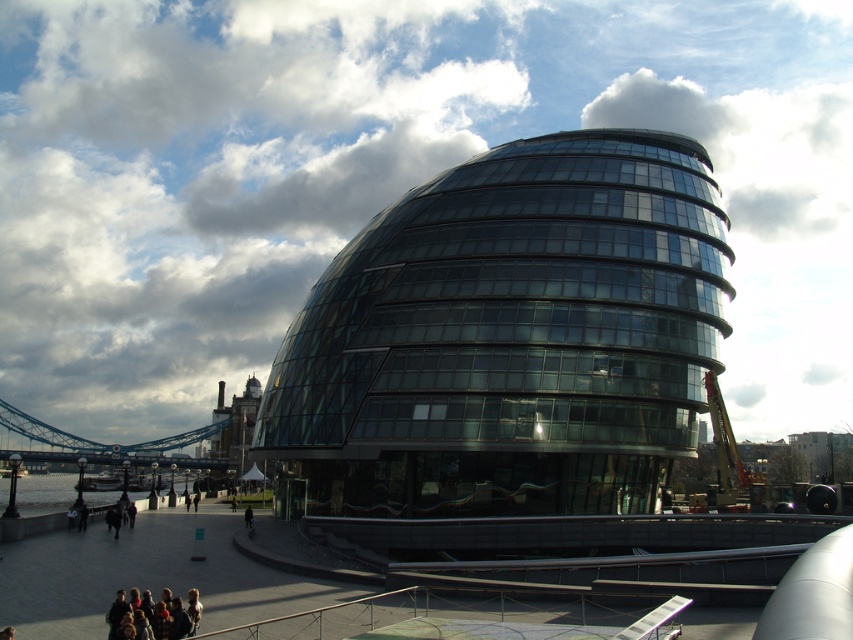
Which is above, transparent glass dome at center or metallic gray suspension bridge at lower left?

transparent glass dome at center is above.

Is point (521, 355) positioned behind point (38, 438)?

No, (521, 355) is closer to viewer.

Between point (583, 256) and point (57, 435), which one is positioned behind?

Positioned behind is point (57, 435).

Locate an element on the screen. The image size is (853, 640). transparent glass dome at center is located at coordinates (508, 339).

Image resolution: width=853 pixels, height=640 pixels. Describe the element at coordinates (508, 339) in the screenshot. I see `transparent glass dome at center` at that location.

Measure the distance from transparent glass dome at center to blurred skin people at lower left.

A distance of 35.47 meters exists between transparent glass dome at center and blurred skin people at lower left.

Is point (614, 454) positioned after point (170, 621)?

Yes, it is.

Where is `transparent glass dome at center`? The width and height of the screenshot is (853, 640). transparent glass dome at center is located at coordinates (508, 339).

Can you confirm if transparent glass dome at center is positioned to the left of metallic construction crane at right?

Yes, transparent glass dome at center is to the left of metallic construction crane at right.

Which is more to the left, transparent glass dome at center or metallic construction crane at right?

transparent glass dome at center is more to the left.

Image resolution: width=853 pixels, height=640 pixels. What are the coordinates of `transparent glass dome at center` in the screenshot? It's located at (508, 339).

I want to click on transparent glass dome at center, so click(x=508, y=339).